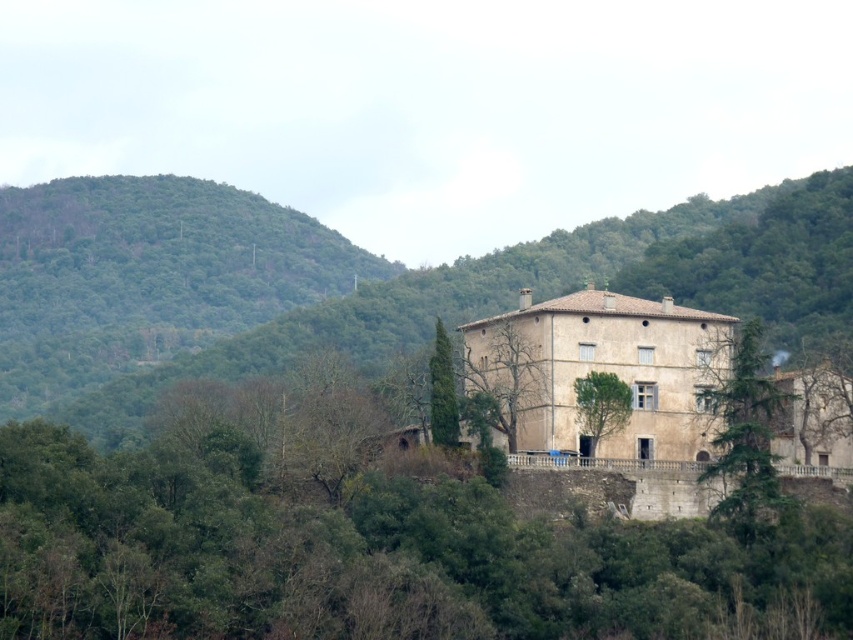
Question: Is beige stone castle at center to the left of green textured tree at center from the viewer's perspective?

Choices:
 (A) yes
 (B) no

Answer: (B)

Question: Where is green leafy hillside at upper left located in relation to bare branches at center in the image?

Choices:
 (A) below
 (B) above

Answer: (B)

Question: Does beige stone castle at center appear under green textured tree at center?

Choices:
 (A) yes
 (B) no

Answer: (A)

Question: Considering the real-world distances, which object is farthest from the bare branches at center?

Choices:
 (A) green leafy hillside at upper left
 (B) green textured tree at center
 (C) beige stone castle at center

Answer: (A)

Question: Which of the following is the farthest from the observer?

Choices:
 (A) green leafy tree at center
 (B) green leafy tree at right
 (C) green leafy hillside at upper left
 (D) green textured tree at center

Answer: (C)

Question: Which is nearer to the green leafy hillside at upper left?

Choices:
 (A) green leafy tree at right
 (B) green textured tree at center
 (C) beige stone castle at center

Answer: (C)